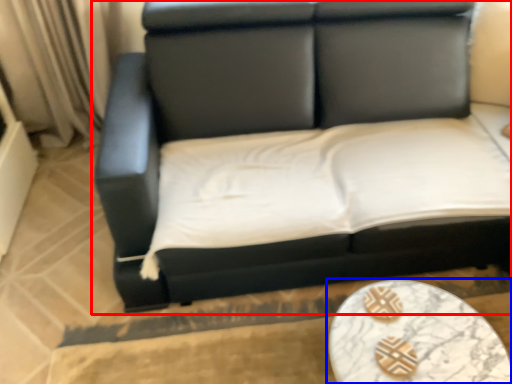
Question: Among these objects, which one is nearest to the camera, studio couch (highlighted by a red box) or table (highlighted by a blue box)?

Choices:
 (A) studio couch
 (B) table

Answer: (A)